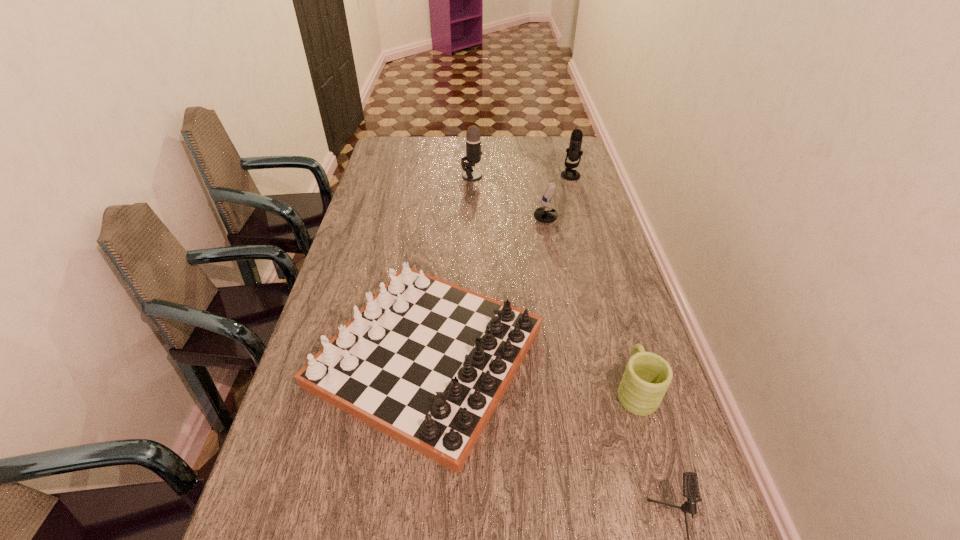
What are the coordinates of `vacant area located 0.220m on the side of the mug with the handle` in the screenshot? It's located at (610, 302).

The image size is (960, 540). What are the coordinates of `object at the left edge` in the screenshot? It's located at coord(426,362).

The width and height of the screenshot is (960, 540). What are the coordinates of `mug located at the right edge` in the screenshot? It's located at (647, 376).

The width and height of the screenshot is (960, 540). Identify the location of vacant region at the far edge of the desktop. (496, 140).

The width and height of the screenshot is (960, 540). I want to click on free space at the left edge of the desktop, so click(x=349, y=255).

Locate an element on the screen. This screenshot has height=540, width=960. free space at the right edge of the desktop is located at coordinates (565, 223).

I want to click on vacant space at the far left corner of the desktop, so click(397, 156).

Locate an element on the screen. The height and width of the screenshot is (540, 960). empty space between the mug and the fourth nearest object is located at coordinates (599, 306).

Find the location of a particular element. free space between the third farthest object and the mug is located at coordinates (599, 306).

Identify the location of free area in between the fourth nearest object and the mug. The image size is (960, 540). (599, 306).